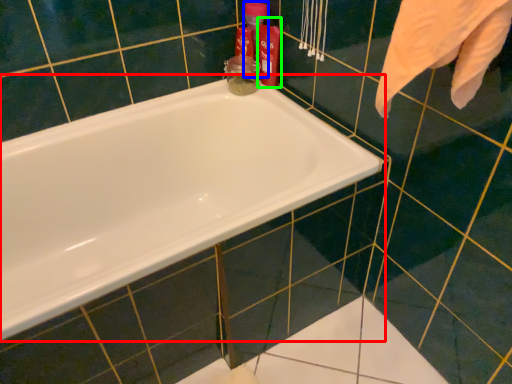
Question: Estimate the real-world distances between objects in this image. Which object is farther from bathtub (highlighted by a red box), cleaning product (highlighted by a blue box) or cleaning product (highlighted by a green box)?

Choices:
 (A) cleaning product
 (B) cleaning product

Answer: (A)